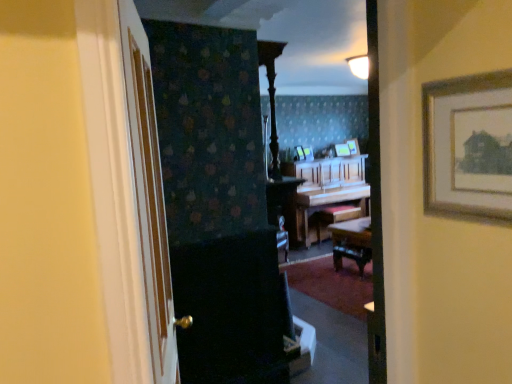
Question: Is wooden picture frame at center, placed as the 1th picture frame when sorted from right to left, inside the boundaries of wooden picture frame at center, which is the 2th picture frame from right to left, or outside?

Choices:
 (A) outside
 (B) inside

Answer: (A)

Question: Considering the positions of wooden picture frame at center, placed as the 1th picture frame when sorted from right to left, and wooden picture frame at center, marked as the third picture frame in a left-to-right arrangement, in the image, is wooden picture frame at center, placed as the 1th picture frame when sorted from right to left, wider or thinner than wooden picture frame at center, marked as the third picture frame in a left-to-right arrangement,?

Choices:
 (A) wide
 (B) thin

Answer: (A)

Question: Based on their relative distances, which object is farther from the wooden piano at center?

Choices:
 (A) white wood door at left
 (B) wooden picture frame at center, placed as the 1th picture frame when sorted from right to left
 (C) wooden picture frame at center, which is the 2th picture frame from right to left
 (D) wooden picture frame at center, which is counted as the 3th picture frame, starting from the right
 (E) metallic silver picture frame at center, which is the first picture frame from left to right

Answer: (A)

Question: Estimate the real-world distances between objects in this image. Which object is closer to the wooden picture frame at center, which is the 2th picture frame from right to left?

Choices:
 (A) wooden picture frame at center, placed as the 1th picture frame when sorted from right to left
 (B) metallic silver picture frame at center, which is the first picture frame from left to right
 (C) white wood door at left
 (D) wooden piano at center
 (E) wooden picture frame at center, marked as the second picture frame in a left-to-right arrangement

Answer: (A)